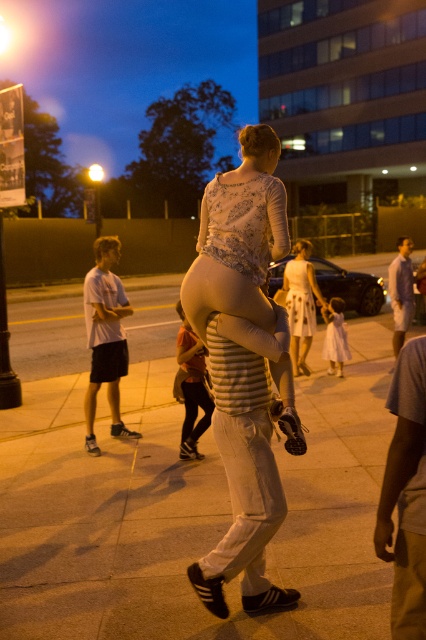
What is located at the coordinates point (190, 512) in the image?

The point (190, 512) indicates the sandy concrete sidewalk at center.

You are standing at the point with coordinates (301, 304) in the image. What object are you directly at?

The point at coordinates (301, 304) is directly at the white lace dress at center.